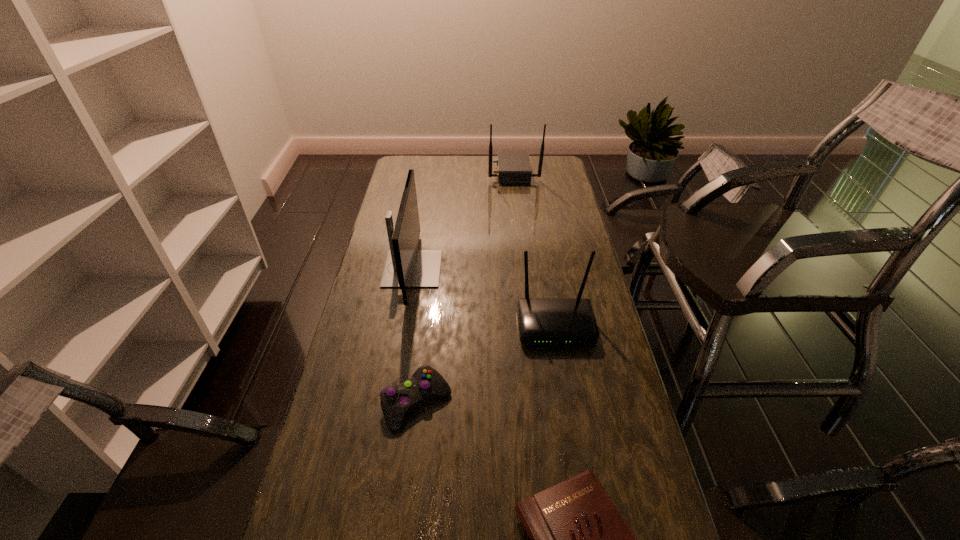
Identify the location of free space that satisfies the following two spatial constraints: 1. on the screen of the second nearest object; 2. on the right side of the computer monitor. (390, 403).

Identify the location of free space that satisfies the following two spatial constraints: 1. on the screen of the computer monitor; 2. on the left side of the control. Image resolution: width=960 pixels, height=540 pixels. (390, 403).